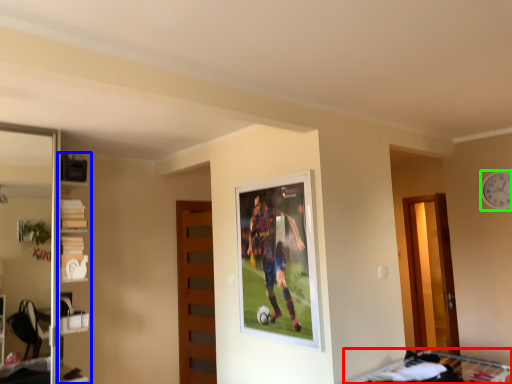
Question: Considering the real-world distances, which object is farthest from bunk bed (highlighted by a red box)? shelf (highlighted by a blue box) or clock (highlighted by a green box)?

Choices:
 (A) shelf
 (B) clock

Answer: (A)